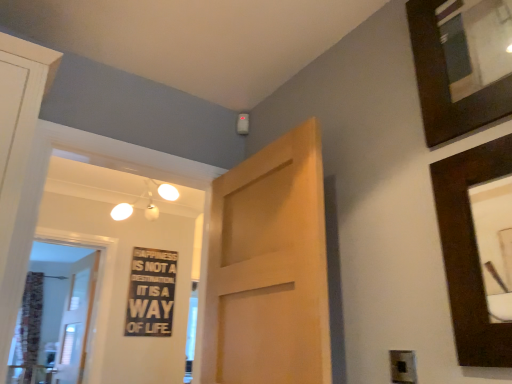
Question: Is black plastic electric outlet at lower right taller than light brown wood door at center, which is the 2th door from left to right?

Choices:
 (A) yes
 (B) no

Answer: (B)

Question: Considering the relative sizes of black plastic electric outlet at lower right and light brown wood door at center, arranged as the first door when viewed from the front, in the image provided, is black plastic electric outlet at lower right bigger than light brown wood door at center, arranged as the first door when viewed from the front,?

Choices:
 (A) no
 (B) yes

Answer: (A)

Question: From a real-world perspective, is black plastic electric outlet at lower right located higher than light brown wood door at center, arranged as the first door when viewed from the front?

Choices:
 (A) no
 (B) yes

Answer: (A)

Question: Does black plastic electric outlet at lower right have a lesser height compared to light brown wood door at center, the 1th door in the right-to-left sequence?

Choices:
 (A) no
 (B) yes

Answer: (B)

Question: Is black plastic electric outlet at lower right far away from light brown wood door at center, which is the 2th door from left to right?

Choices:
 (A) no
 (B) yes

Answer: (A)

Question: Looking at the image, does white wooden door at left, marked as the 1th door in a back-to-front arrangement, seem bigger or smaller compared to patterned fabric curtain at left?

Choices:
 (A) small
 (B) big

Answer: (A)

Question: Choose the correct answer: Is white wooden door at left, which ranks as the second door in front-to-back order, inside patterned fabric curtain at left or outside it?

Choices:
 (A) outside
 (B) inside

Answer: (A)

Question: Is white wooden door at left, marked as the 2th door in a right-to-left arrangement, taller or shorter than patterned fabric curtain at left?

Choices:
 (A) tall
 (B) short

Answer: (B)

Question: Considering the positions of white wooden door at left, which ranks as the second door in front-to-back order, and patterned fabric curtain at left in the image, is white wooden door at left, which ranks as the second door in front-to-back order, wider or thinner than patterned fabric curtain at left?

Choices:
 (A) thin
 (B) wide

Answer: (A)

Question: From the image's perspective, relative to black plastic electric outlet at lower right, is dark wood picture frame at upper right, the 1th picture frame ordered from the bottom, above or below?

Choices:
 (A) above
 (B) below

Answer: (A)

Question: Looking at their shapes, would you say dark wood picture frame at upper right, the second picture frame positioned from the top, is wider or thinner than black plastic electric outlet at lower right?

Choices:
 (A) thin
 (B) wide

Answer: (B)

Question: From a real-world perspective, relative to black plastic electric outlet at lower right, is dark wood picture frame at upper right, the 1th picture frame ordered from the bottom, vertically above or below?

Choices:
 (A) below
 (B) above

Answer: (B)

Question: Relative to black plastic electric outlet at lower right, is dark wood picture frame at upper right, the 1th picture frame ordered from the bottom, in front or behind?

Choices:
 (A) front
 (B) behind

Answer: (A)

Question: From a real-world perspective, is black plastic electric outlet at lower right above or below black wood sign at center?

Choices:
 (A) above
 (B) below

Answer: (B)

Question: In terms of width, does black plastic electric outlet at lower right look wider or thinner when compared to black wood sign at center?

Choices:
 (A) wide
 (B) thin

Answer: (B)